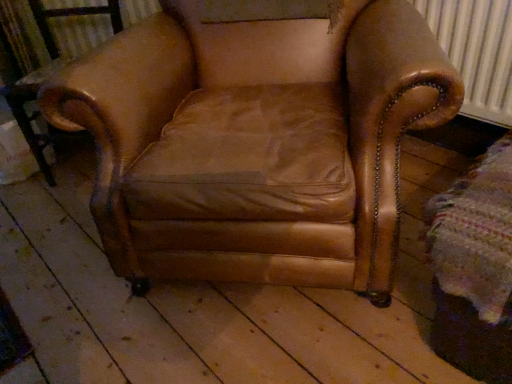
Question: Is leather armchair at center wider or thinner than metallic black side table at left?

Choices:
 (A) thin
 (B) wide

Answer: (B)

Question: From the image's perspective, is leather armchair at center above or below metallic black side table at left?

Choices:
 (A) above
 (B) below

Answer: (A)

Question: Based on their sizes in the image, would you say leather armchair at center is bigger or smaller than metallic black side table at left?

Choices:
 (A) big
 (B) small

Answer: (A)

Question: Considering the positions of metallic black side table at left and leather armchair at center in the image, is metallic black side table at left taller or shorter than leather armchair at center?

Choices:
 (A) short
 (B) tall

Answer: (A)

Question: Is metallic black side table at left situated inside leather armchair at center or outside?

Choices:
 (A) outside
 (B) inside

Answer: (A)

Question: Considering the positions of metallic black side table at left and leather armchair at center in the image, is metallic black side table at left wider or thinner than leather armchair at center?

Choices:
 (A) thin
 (B) wide

Answer: (A)

Question: From the image's perspective, is metallic black side table at left located above or below leather armchair at center?

Choices:
 (A) above
 (B) below

Answer: (B)